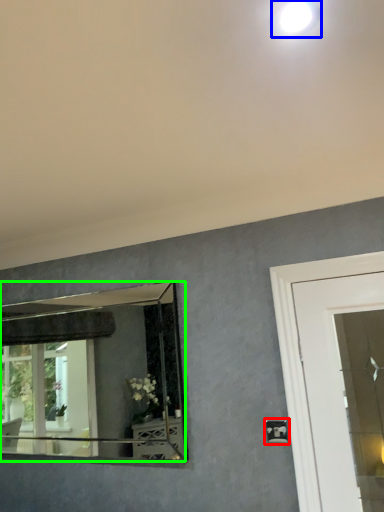
Question: Which is nearer to the light switch (highlighted by a red box)? droplight (highlighted by a blue box) or mirror (highlighted by a green box).

Choices:
 (A) droplight
 (B) mirror

Answer: (A)